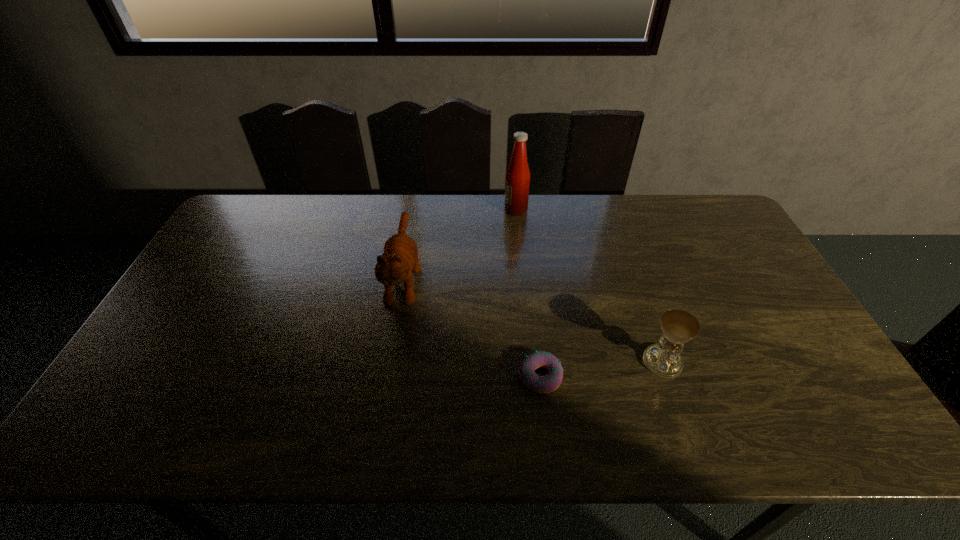
Choose which object is the nearest neighbor to the leftmost object. Please provide its 2D coordinates. Your answer should be formatted as a tuple, i.e. [(x, y)], where the tuple contains the x and y coordinates of a point satisfying the conditions above.

[(517, 182)]

What are the coordinates of `free space in the image that satisfies the following two spatial constraints: 1. on the front-facing side of the farthest object; 2. on the face of the third nearest object` in the screenshot? It's located at (522, 276).

Find the location of a particular element. The height and width of the screenshot is (540, 960). free region that satisfies the following two spatial constraints: 1. on the face of the cat; 2. on the left side of the doughnut is located at coordinates (387, 376).

Locate an element on the screen. This screenshot has height=540, width=960. free space that satisfies the following two spatial constraints: 1. on the front-facing side of the tallest object; 2. on the right side of the third tallest object is located at coordinates (530, 362).

Find the location of a particular element. free location that satisfies the following two spatial constraints: 1. on the face of the third nearest object; 2. on the right side of the doughnut is located at coordinates point(387,376).

Image resolution: width=960 pixels, height=540 pixels. Identify the location of free spot that satisfies the following two spatial constraints: 1. on the front-facing side of the farthest object; 2. on the face of the leftmost object. (522, 276).

The width and height of the screenshot is (960, 540). I want to click on vacant space that satisfies the following two spatial constraints: 1. on the front-facing side of the farthest object; 2. on the face of the second tallest object, so click(522, 276).

You are a GUI agent. You are given a task and a screenshot of the screen. Output one action in this format:
    pyautogui.click(x=<x>, y=<y>)
    Task: Click on the vacant area in the image that satisfies the following two spatial constraints: 1. on the face of the second farthest object; 2. on the left side of the shortest object
    
    Given the screenshot: What is the action you would take?
    pyautogui.click(x=387, y=376)

I want to click on blank space that satisfies the following two spatial constraints: 1. on the front-facing side of the chalice; 2. on the right side of the condiment, so click(x=530, y=362).

You are a GUI agent. You are given a task and a screenshot of the screen. Output one action in this format:
    pyautogui.click(x=<x>, y=<y>)
    Task: Click on the vacant space that satisfies the following two spatial constraints: 1. on the front-facing side of the tallest object; 2. on the face of the cat
    This screenshot has height=540, width=960.
    Given the screenshot: What is the action you would take?
    pyautogui.click(x=522, y=276)